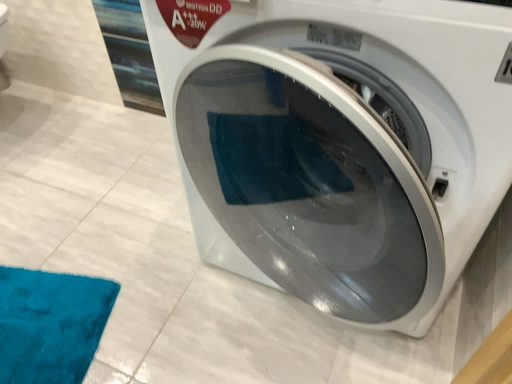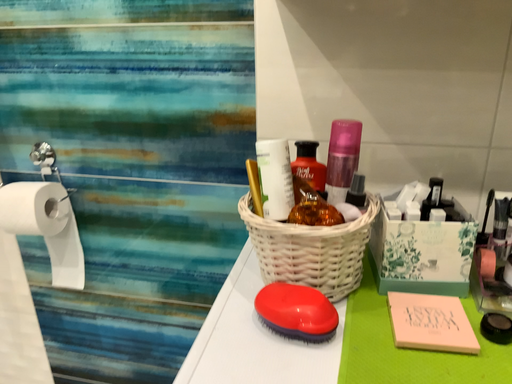
Question: How did the camera likely rotate when shooting the video?

Choices:
 (A) rotated upward
 (B) rotated downward

Answer: (A)